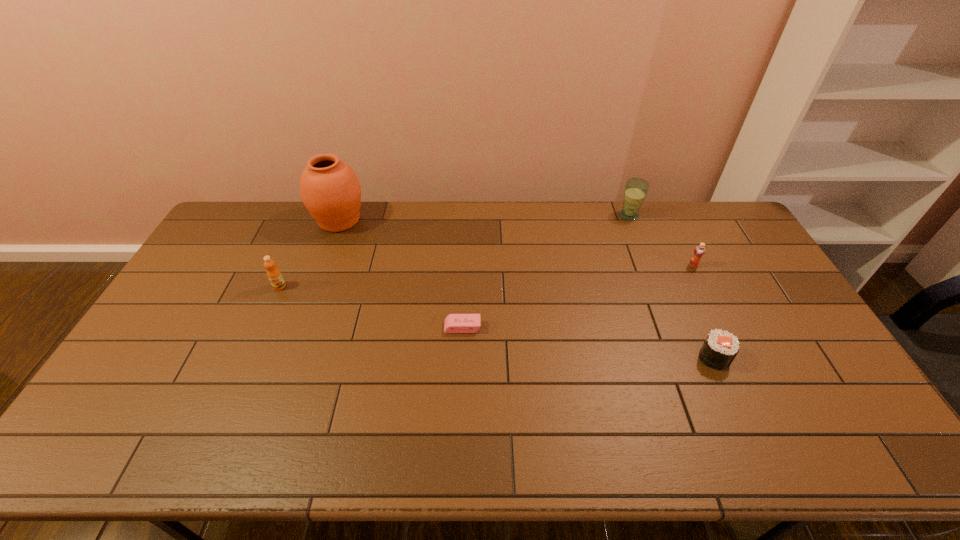
Where is `urn`? This screenshot has width=960, height=540. urn is located at coordinates (330, 190).

Locate an element on the screen. The height and width of the screenshot is (540, 960). glass is located at coordinates (x=635, y=191).

This screenshot has height=540, width=960. Identify the location of the fourth farthest object. (275, 277).

Locate an element on the screen. This screenshot has height=540, width=960. the taller orange juice is located at coordinates (275, 277).

Identify the location of the right orange juice. The height and width of the screenshot is (540, 960). (699, 251).

Identify the location of the rightmost object. The height and width of the screenshot is (540, 960). tap(699, 251).

Locate an element on the screen. the second shortest object is located at coordinates tap(719, 349).

Find the location of a particular element. The height and width of the screenshot is (540, 960). sushi is located at coordinates (719, 349).

You are a GUI agent. You are given a task and a screenshot of the screen. Output one action in this format:
    pyautogui.click(x=<x>, y=<y>)
    Task: Click on the fourth object from right to left
    The height and width of the screenshot is (540, 960).
    Given the screenshot: What is the action you would take?
    pyautogui.click(x=454, y=323)

This screenshot has height=540, width=960. I want to click on the shortest object, so click(x=454, y=323).